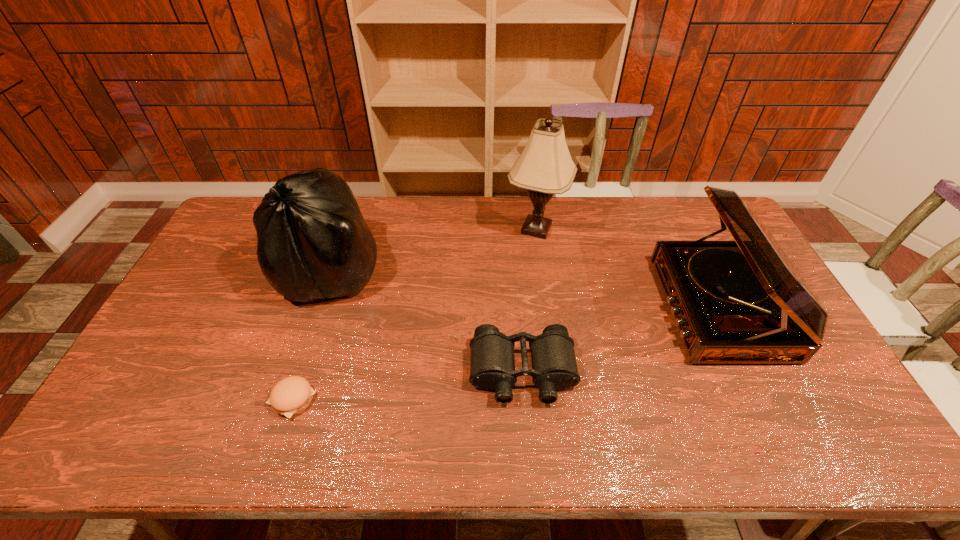
Locate an element on the screen. empty space between the patty and the lamp is located at coordinates (415, 314).

Find the location of a particular element. The width and height of the screenshot is (960, 540). empty space between the shortest object and the lamp is located at coordinates (415, 314).

Where is `blank region between the third tallest object and the plastic bag`? This screenshot has width=960, height=540. blank region between the third tallest object and the plastic bag is located at coordinates (525, 288).

Locate which object ranks third in proximity to the plastic bag. Please provide its 2D coordinates. Your answer should be formatted as a tuple, i.e. [(x, y)], where the tuple contains the x and y coordinates of a point satisfying the conditions above.

[(545, 167)]

Where is `the fourth closest object relative to the lamp`? Image resolution: width=960 pixels, height=540 pixels. the fourth closest object relative to the lamp is located at coordinates click(290, 396).

Image resolution: width=960 pixels, height=540 pixels. Identify the location of vacant space that satisfies the following two spatial constraints: 1. on the back side of the plastic bag; 2. on the left side of the lamp. (345, 229).